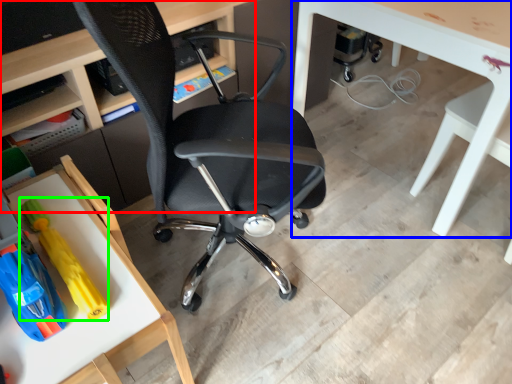
Question: Which is nearer to the desk (highlighted by a red box)? table (highlighted by a blue box) or toy (highlighted by a green box).

Choices:
 (A) table
 (B) toy

Answer: (B)